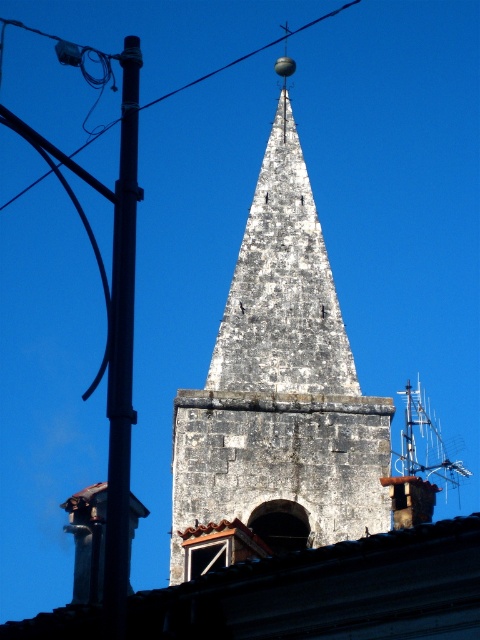
You are an architect examining the historical tower. You notice the weathered stone steeple at center and the black wire at upper left. Which object is nearer to you?

The weathered stone steeple at center is closer to the viewer than the black wire at upper left.

You are a photographer aiming to capture the stone tower without any modern elements in the shot. You notice the metallic pole at left and the black wire at upper left in the frame. Which object should you adjust your camera angle to avoid?

You should adjust your camera angle to avoid the metallic pole at left because it is positioned under the black wire at upper left, meaning the pole is closer to the camera and obscuring the tower.

You are standing in a park and see the weathered stone steeple at center and the metallic pole at left. Which object is closer to you?

The metallic pole at left is closer to you because the weathered stone steeple at center is further to the viewer than the metallic pole at left.